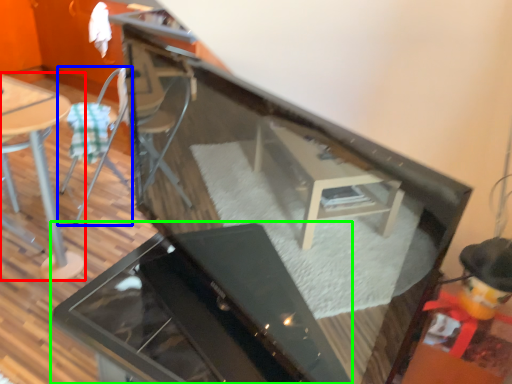
Question: Considering the real-world distances, which object is farthest from table (highlighted by a red box)? chair (highlighted by a blue box) or grill (highlighted by a green box)?

Choices:
 (A) chair
 (B) grill

Answer: (B)